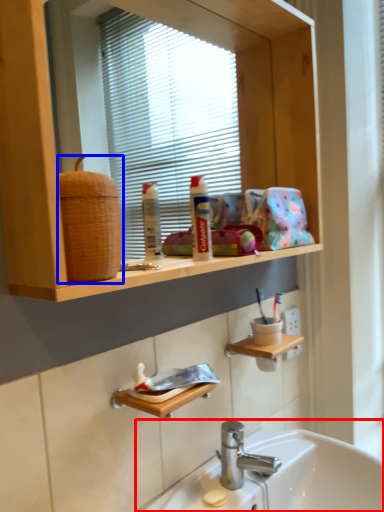
Question: Which point is closer to the camera, sink (highlighted by a red box) or basket (highlighted by a blue box)?

Choices:
 (A) sink
 (B) basket

Answer: (B)